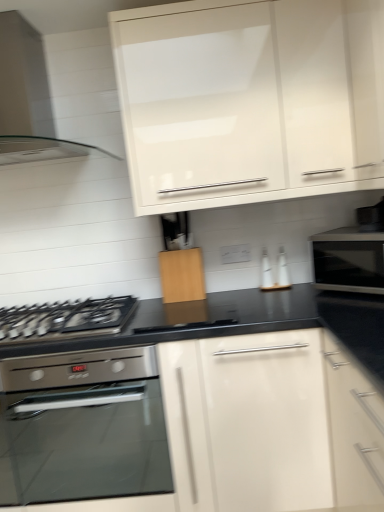
This screenshot has width=384, height=512. Describe the element at coordinates (250, 99) in the screenshot. I see `white glossy cabinet at upper center, which is the second cabinetry from bottom to top` at that location.

Describe the element at coordinates (26, 89) in the screenshot. The width and height of the screenshot is (384, 512). I see `clear glass range hood at upper left` at that location.

This screenshot has width=384, height=512. Identify the location of black matte gas stove at lower left. (65, 319).

Measure the distance between stainless steel oven at lower left and camera.

A distance of 6.48 feet exists between stainless steel oven at lower left and camera.

Measure the distance between point [311,242] and camera.

Point [311,242] is 6.38 feet from camera.

This screenshot has height=512, width=384. What are the coordinates of `white glossy cabinet at upper center, arranged as the first cabinetry when viewed from the top` in the screenshot? It's located at (250, 99).

From the image's perspective, is stainless steel oven at lower left above or below black glossy microwave at right?

stainless steel oven at lower left is situated lower than black glossy microwave at right in the image.

Is there a large distance between stainless steel oven at lower left and black glossy microwave at right?

stainless steel oven at lower left is far away from black glossy microwave at right.

Would you say black glossy microwave at right is part of stainless steel oven at lower left's contents?

No, stainless steel oven at lower left does not contain black glossy microwave at right.

Could you tell me if stainless steel oven at lower left is facing wooden cutting board at center, which is the 1th cabinetry in bottom-to-top order?

No, stainless steel oven at lower left is not turned towards wooden cutting board at center, which is the 1th cabinetry in bottom-to-top order.

Considering the points (150, 494) and (171, 256), which point is behind, point (150, 494) or point (171, 256)?

The point (171, 256) is farther from the camera.

Between stainless steel oven at lower left and wooden cutting board at center, which is the 1th cabinetry in bottom-to-top order, which one has larger size?

With larger size is stainless steel oven at lower left.

Is wooden cutting board at center, which is the 1th cabinetry in bottom-to-top order, completely or partially inside stainless steel oven at lower left?

No, stainless steel oven at lower left does not contain wooden cutting board at center, which is the 1th cabinetry in bottom-to-top order.

From the image's perspective, which object appears higher, clear glass range hood at upper left or white glossy cabinet at upper center, arranged as the first cabinetry when viewed from the top?

clear glass range hood at upper left.

How distant is clear glass range hood at upper left from white glossy cabinet at upper center, arranged as the first cabinetry when viewed from the top?

clear glass range hood at upper left is 27.62 inches from white glossy cabinet at upper center, arranged as the first cabinetry when viewed from the top.

Can you confirm if clear glass range hood at upper left is wider than white glossy cabinet at upper center, which is the second cabinetry from bottom to top?

Indeed, clear glass range hood at upper left has a greater width compared to white glossy cabinet at upper center, which is the second cabinetry from bottom to top.

What are the coordinates of `cabinetry in front of the clear glass range hood at upper left` in the screenshot? It's located at (250, 99).

Is white glossy cabinet at upper center, arranged as the first cabinetry when viewed from the top, inside stainless steel oven at lower left?

No, white glossy cabinet at upper center, arranged as the first cabinetry when viewed from the top, is not inside stainless steel oven at lower left.

Would you consider stainless steel oven at lower left to be distant from white glossy cabinet at upper center, which is the second cabinetry from bottom to top?

Indeed, stainless steel oven at lower left is not near white glossy cabinet at upper center, which is the second cabinetry from bottom to top.

Where is `the 1st cabinetry behind the stainless steel oven at lower left`? the 1st cabinetry behind the stainless steel oven at lower left is located at coordinates (250, 99).

Consider the image. Which of these two, stainless steel oven at lower left or white glossy cabinet at upper center, arranged as the first cabinetry when viewed from the top, is thinner?

white glossy cabinet at upper center, arranged as the first cabinetry when viewed from the top.

Who is more distant, wooden cutting board at center, which is the 1th cabinetry in bottom-to-top order, or clear glass range hood at upper left?

wooden cutting board at center, which is the 1th cabinetry in bottom-to-top order, is further away from the camera.

From a real-world perspective, who is located lower, wooden cutting board at center, which ranks as the 2th cabinetry in top-to-bottom order, or clear glass range hood at upper left?

wooden cutting board at center, which ranks as the 2th cabinetry in top-to-bottom order, is physically lower.

Considering the sizes of objects wooden cutting board at center, which ranks as the 2th cabinetry in top-to-bottom order, and clear glass range hood at upper left in the image provided, who is taller, wooden cutting board at center, which ranks as the 2th cabinetry in top-to-bottom order, or clear glass range hood at upper left?

With more height is clear glass range hood at upper left.

Is clear glass range hood at upper left at the back of wooden cutting board at center, which ranks as the 2th cabinetry in top-to-bottom order?

No, clear glass range hood at upper left is not at the back of wooden cutting board at center, which ranks as the 2th cabinetry in top-to-bottom order.

From the picture: Who is smaller, clear glass range hood at upper left or stainless steel oven at lower left?

Smaller between the two is clear glass range hood at upper left.

Could you tell me if clear glass range hood at upper left is facing stainless steel oven at lower left?

No, clear glass range hood at upper left is not facing towards stainless steel oven at lower left.

From a real-world perspective, which object rests below the other?

stainless steel oven at lower left, from a real-world perspective.

From a real-world perspective, who is located higher, clear glass range hood at upper left or black glossy microwave at right?

From a 3D spatial view, clear glass range hood at upper left is above.

Would you say clear glass range hood at upper left is outside black glossy microwave at right?

Yes, clear glass range hood at upper left is not within black glossy microwave at right.

In the scene shown: Is clear glass range hood at upper left placed right next to black glossy microwave at right?

clear glass range hood at upper left is not next to black glossy microwave at right, and they're not touching.

Considering the relative positions of clear glass range hood at upper left and black glossy microwave at right in the image provided, is clear glass range hood at upper left to the left or to the right of black glossy microwave at right?

clear glass range hood at upper left is to the left of black glossy microwave at right.

This screenshot has height=512, width=384. Find the location of `microwave oven above the stainless steel oven at lower left (from the image's perspective)`. microwave oven above the stainless steel oven at lower left (from the image's perspective) is located at coordinates point(348,260).

Locate an element on the screen. This screenshot has height=512, width=384. cabinetry that is the 1st one when counting rightward from the stainless steel oven at lower left is located at coordinates tap(182, 275).

Based on the photo, when comparing their distances from wooden cutting board at center, which ranks as the 2th cabinetry in top-to-bottom order, does black matte gas stove at lower left or clear glass range hood at upper left seem further?

clear glass range hood at upper left is positioned further to the anchor wooden cutting board at center, which ranks as the 2th cabinetry in top-to-bottom order.

From the image, which object appears to be nearer to stainless steel oven at lower left, clear glass range hood at upper left or black glossy microwave at right?

The object closer to stainless steel oven at lower left is black glossy microwave at right.

From the image, which object appears to be nearer to wooden cutting board at center, which is the 1th cabinetry in bottom-to-top order, clear glass range hood at upper left or black glossy microwave at right?

Among the two, black glossy microwave at right is located nearer to wooden cutting board at center, which is the 1th cabinetry in bottom-to-top order.

When comparing their distances from black glossy microwave at right, does black matte gas stove at lower left or stainless steel oven at lower left seem further?

Based on the image, stainless steel oven at lower left appears to be further to black glossy microwave at right.

When comparing their distances from stainless steel oven at lower left, does black matte gas stove at lower left or wooden cutting board at center, which is the 1th cabinetry in bottom-to-top order, seem further?

wooden cutting board at center, which is the 1th cabinetry in bottom-to-top order, is positioned further to the anchor stainless steel oven at lower left.

Looking at the image, which one is located further to wooden cutting board at center, which ranks as the 2th cabinetry in top-to-bottom order, stainless steel oven at lower left or black glossy microwave at right?

Among the two, stainless steel oven at lower left is located further to wooden cutting board at center, which ranks as the 2th cabinetry in top-to-bottom order.

From the image, which object appears to be farther from wooden cutting board at center, which is the 1th cabinetry in bottom-to-top order, black glossy microwave at right or black matte gas stove at lower left?

black glossy microwave at right.

Based on their spatial positions, is black matte gas stove at lower left or stainless steel oven at lower left closer to clear glass range hood at upper left?

The object closer to clear glass range hood at upper left is black matte gas stove at lower left.

Find the location of a particular element. The image size is (384, 512). cabinetry between white glossy cabinet at upper center, which is the second cabinetry from bottom to top, and stainless steel oven at lower left vertically is located at coordinates (182, 275).

Locate an element on the screen. microwave oven between white glossy cabinet at upper center, arranged as the first cabinetry when viewed from the top, and stainless steel oven at lower left vertically is located at coordinates (348, 260).

The height and width of the screenshot is (512, 384). Find the location of `kitchen appliance located between clear glass range hood at upper left and black glossy microwave at right in the left-right direction`. kitchen appliance located between clear glass range hood at upper left and black glossy microwave at right in the left-right direction is located at coordinates (83, 429).

Where is `gas stove between clear glass range hood at upper left and stainless steel oven at lower left in the vertical direction`? Image resolution: width=384 pixels, height=512 pixels. gas stove between clear glass range hood at upper left and stainless steel oven at lower left in the vertical direction is located at coordinates (65, 319).